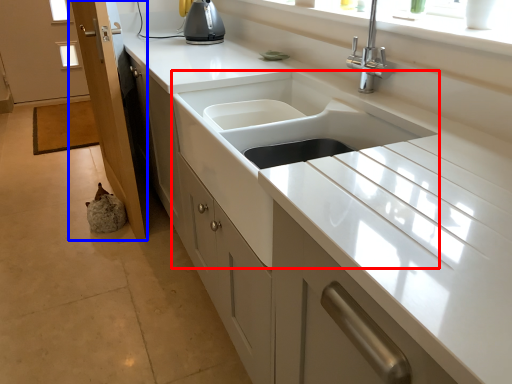
Question: Which of the following is the farthest to the observer, sink (highlighted by a red box) or screen door (highlighted by a blue box)?

Choices:
 (A) sink
 (B) screen door

Answer: (B)